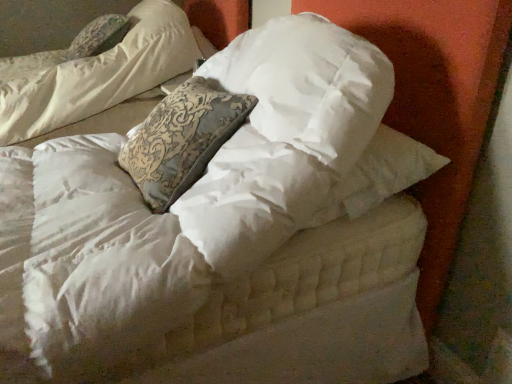
The image size is (512, 384). What do you see at coordinates (98, 36) in the screenshot? I see `white fabric pillow at upper left` at bounding box center [98, 36].

Identify the location of white fabric pillow at upper left. This screenshot has width=512, height=384. (98, 36).

This screenshot has height=384, width=512. I want to click on white fabric pillow at upper left, so click(98, 36).